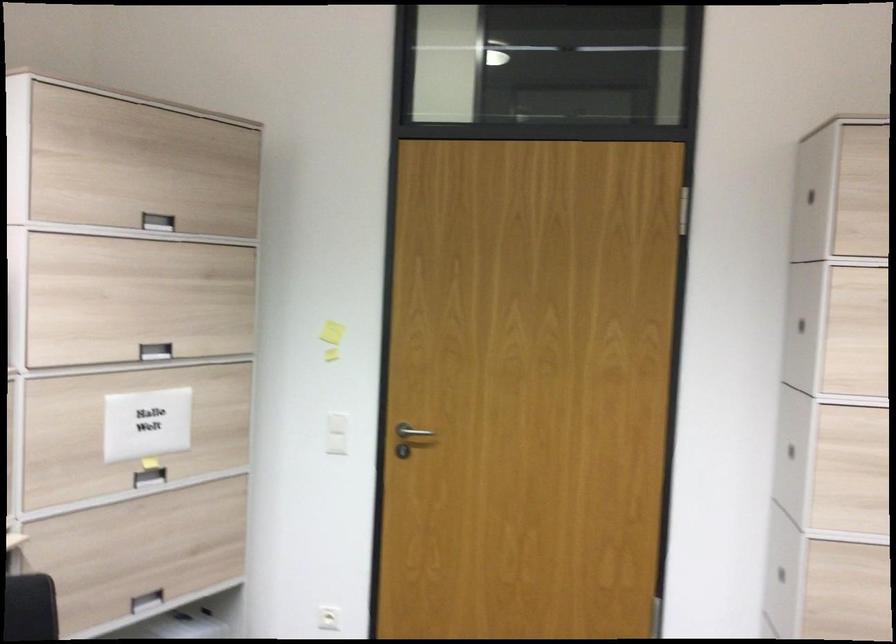
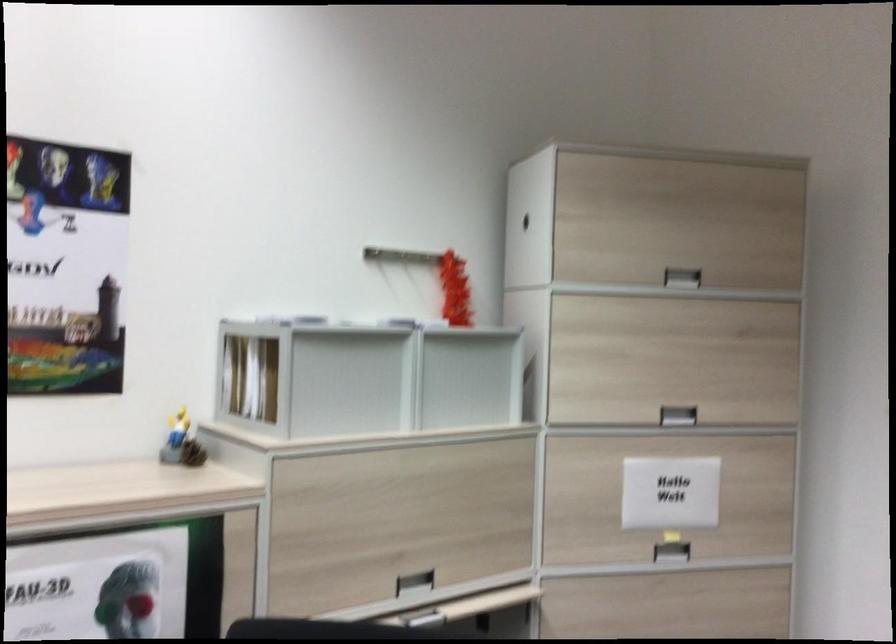
Find the pixel in the second image that matches the point at 151,353 in the first image.

(677, 415)